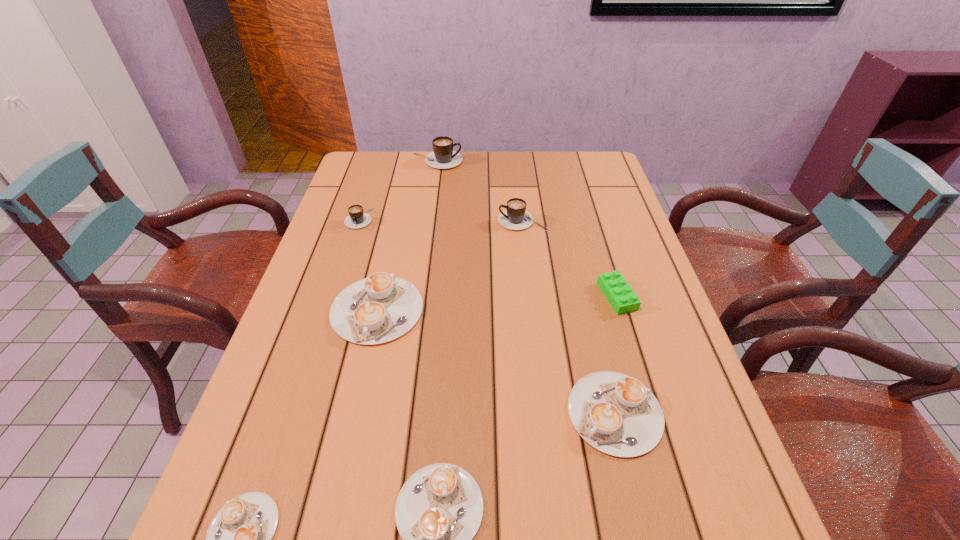
Find the location of a particular element. Image resolution: width=960 pixels, height=540 pixels. object that is the second closest to the smallest white cappuccino is located at coordinates (382, 307).

Where is `cappuccino that is the sixth closest to the farthest black cappuccino`? Image resolution: width=960 pixels, height=540 pixels. cappuccino that is the sixth closest to the farthest black cappuccino is located at coordinates (238, 539).

Where is `cappuccino that stands as the fourth closest to the rightmost black cappuccino`? This screenshot has width=960, height=540. cappuccino that stands as the fourth closest to the rightmost black cappuccino is located at coordinates (616, 414).

Locate an element on the screen. This screenshot has height=540, width=960. black cappuccino that is the second closest one to the leftmost black cappuccino is located at coordinates (515, 217).

You are a GUI agent. You are given a task and a screenshot of the screen. Output one action in this format:
    pyautogui.click(x=<x>, y=<y>)
    Task: Click on the black cappuccino that stands as the second closest to the third nearest object
    The height and width of the screenshot is (540, 960).
    Given the screenshot: What is the action you would take?
    pyautogui.click(x=357, y=218)

Identify which white cappuccino is the third nearest to the fourth farthest cappuccino. Please provide its 2D coordinates. Your answer should be formatted as a tuple, i.e. [(x, y)], where the tuple contains the x and y coordinates of a point satisfying the conditions above.

[(616, 414)]

Where is `white cappuccino that can be found as the second closest to the second shortest object`? The height and width of the screenshot is (540, 960). white cappuccino that can be found as the second closest to the second shortest object is located at coordinates (238, 539).

You are a GUI agent. You are given a task and a screenshot of the screen. Output one action in this format:
    pyautogui.click(x=<x>, y=<y>)
    Task: Click on the vacant space that satisfies the following two spatial constraints: 1. with the handle on the side of the second black cappuccino from left to right; 2. on the back side of the third nearest cappuccino
    
    Given the screenshot: What is the action you would take?
    pyautogui.click(x=401, y=413)

Identify the location of free space that satisfies the following two spatial constraints: 1. with the handle on the side of the Lego; 2. on the right side of the smallest black cappuccino. (334, 296).